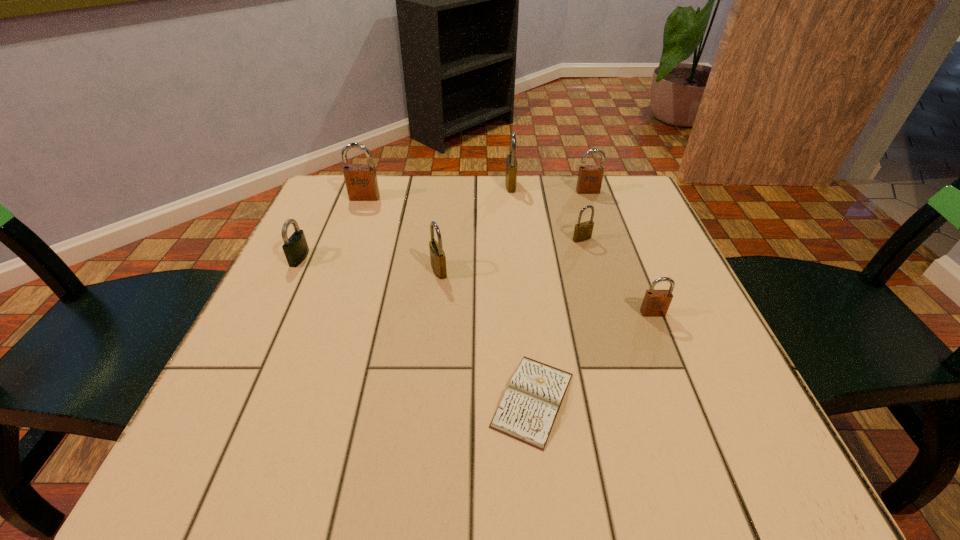
Locate an element on the screen. This screenshot has width=960, height=540. the farthest brass padlock is located at coordinates (511, 162).

At what (x,y) coordinates should I click in order to perform the action: click on the biggest brass padlock. Please return your answer as a coordinate pair (x, y). This screenshot has width=960, height=540. Looking at the image, I should click on (511, 162).

This screenshot has height=540, width=960. In order to click on the second padlock from left to right in this screenshot , I will do `click(361, 182)`.

I want to click on the leftmost brown padlock, so click(x=361, y=182).

I want to click on the second biggest brown padlock, so click(590, 177).

Locate an element on the screen. Image resolution: width=960 pixels, height=540 pixels. the leftmost brass padlock is located at coordinates (437, 256).

You are a GUI agent. You are given a task and a screenshot of the screen. Output one action in this format:
    pyautogui.click(x=<x>, y=<y>)
    Task: Click on the second smallest brass padlock
    
    Given the screenshot: What is the action you would take?
    pyautogui.click(x=437, y=256)

Find the location of a particular element. The image size is (960, 540). the leftmost padlock is located at coordinates (296, 249).

Find the location of a particular element. black padlock is located at coordinates (296, 249).

Find the location of a particular element. the fourth farthest padlock is located at coordinates (583, 231).